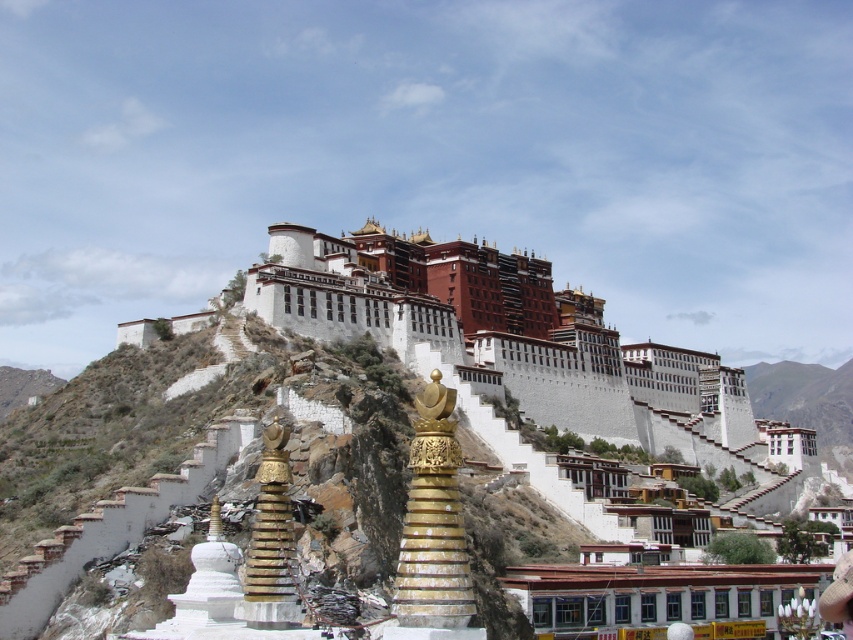
You are a tourist visiting the Potala Palace and want to take a photo that includes both the white stone building at upper center and the gold polished stupa at center. Considering their sizes, which object should you focus on to ensure both fit in the frame?

The white stone building at upper center is bigger than the gold polished stupa at center. To ensure both fit in the frame, focus on the white stone building at upper center as it is larger and will require more space in the photo.

You are a photographer planning to capture the white stone building at upper center and the gold metallic stupa at center in a single frame. Based on their sizes, which object should you focus on to ensure both are clearly visible in the photo?

The white stone building at upper center is bigger than the gold metallic stupa at center, so focusing on the white stone building at upper center will help ensure both objects are clearly visible in the photo.